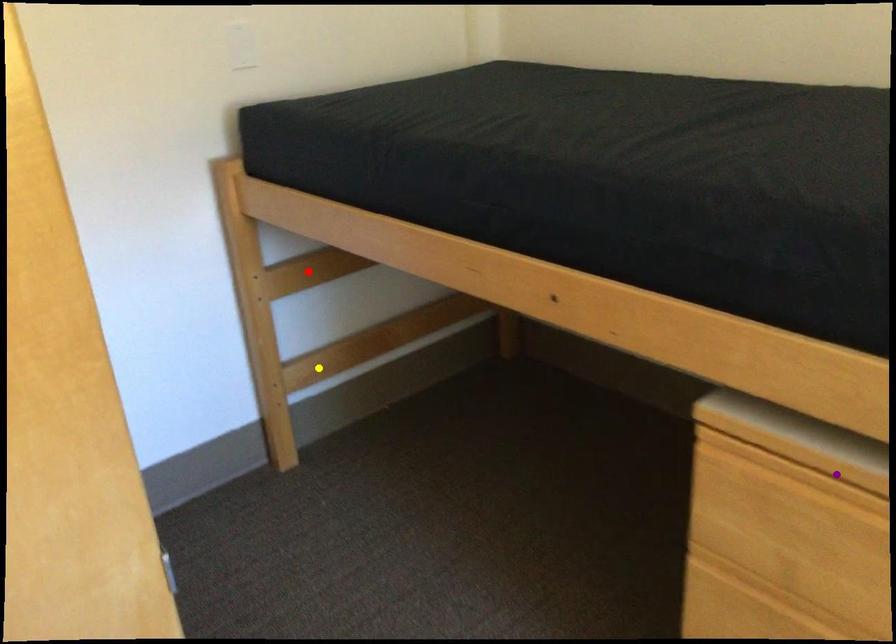
Order these from nearest to farthest:
A) red point
B) purple point
C) yellow point

purple point → red point → yellow point